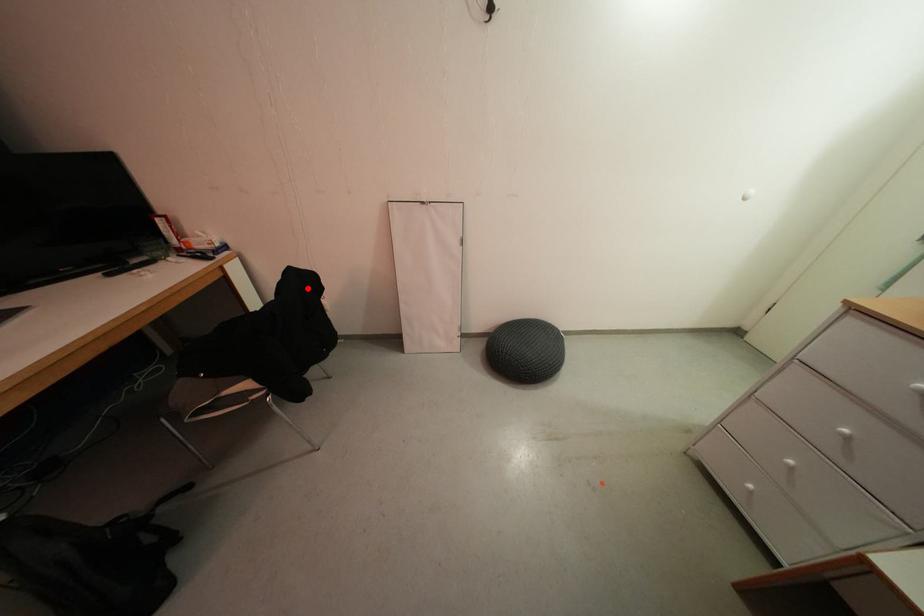
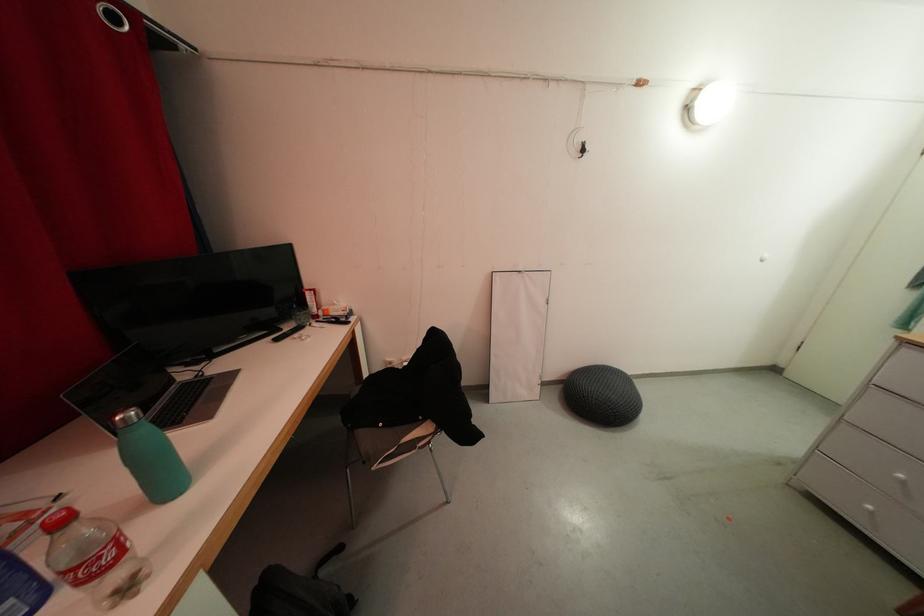
In the second image, find the point that corresponds to the highlighted location in the first image.

(441, 345)